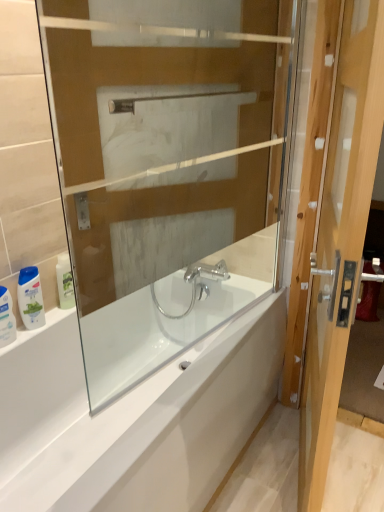
Question: From a real-world perspective, is light brown wooden door at right positioned above or below white glossy bathtub at center?

Choices:
 (A) below
 (B) above

Answer: (B)

Question: Considering the positions of light brown wooden door at right and white glossy bathtub at center in the image, is light brown wooden door at right wider or thinner than white glossy bathtub at center?

Choices:
 (A) wide
 (B) thin

Answer: (B)

Question: Based on their relative distances, which object is farther from the light brown wooden door at right?

Choices:
 (A) white glossy shampoo bottle at lower left, the second toiletry viewed from the left
 (B) transparent glass bathtub at center
 (C) white glossy bottle at lower left, which ranks as the 3th toiletry in right-to-left order
 (D) white glossy bathtub at center
 (E) white glossy bottle at left, arranged as the first toiletry when viewed from the right

Answer: (C)

Question: Estimate the real-world distances between objects in this image. Which object is closer to the white glossy shampoo bottle at lower left, which appears as the 2th toiletry when viewed from the right?

Choices:
 (A) white glossy bottle at lower left, which appears as the first toiletry when viewed from the left
 (B) white glossy bathtub at center
 (C) transparent glass bathtub at center
 (D) white glossy bottle at left, which is the third toiletry in left-to-right order
 (E) light brown wooden door at right

Answer: (A)